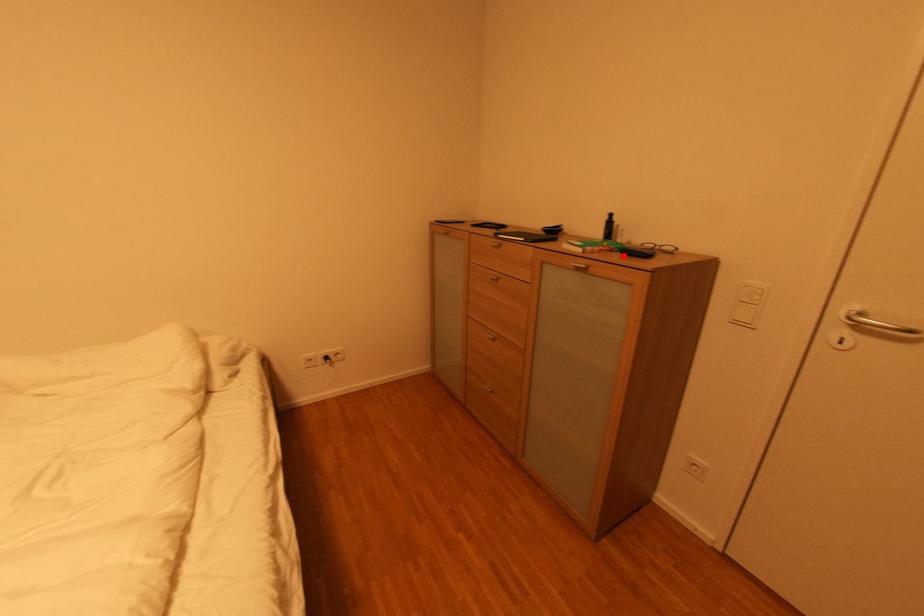
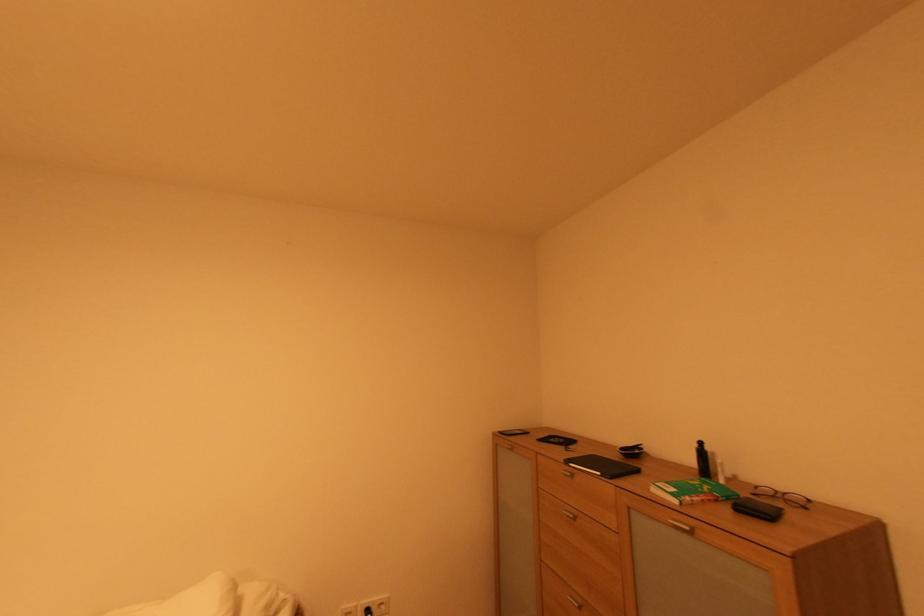
The point at the highlighted location is marked in the first image. Where is the corresponding point in the second image?

(734, 511)